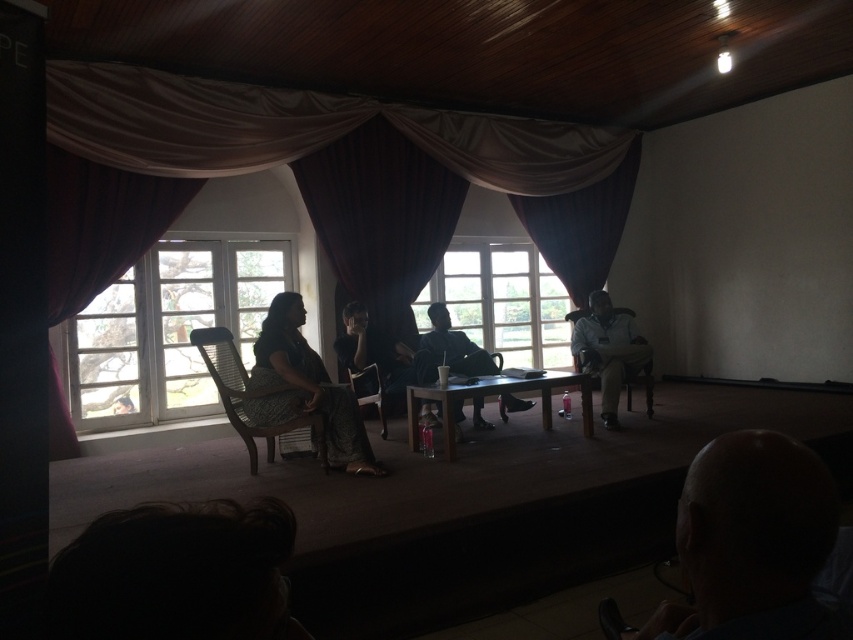
You are a stagehand who needs to place a 28 inch wide decorative panel between the wooden table at center and the matte black shirt at center. Can the panel fit in the space between them?

The distance between the wooden table at center and the matte black shirt at center is 30.65 inches. Since the panel is 28 inches wide, it can fit within the available space as 28 is less than 30.65.

You are an event organizer arranging a small gathering in the conference room. You need to place a 1.2 meter wide decorative panel between the white wooden window at left and the woven wood chair at center. Can the space between them accommodate the panel?

The white wooden window at left is wider than the woven wood chair at center. However, the exact distance between them isn not specified in the provided information. Without knowing the actual spacing, it is impossible to determine if the 1.2 meter panel will fit.

You are an event planner setting up a conference room. You need to ensure that the white wooden window at left and the woven wood chair at center are visible to all attendees. Since the chair is shorter, where should you place the chair relative to the window to ensure visibility?

The white wooden window at left is taller than the woven wood chair at center. To ensure visibility, the woven wood chair at center should be placed in front of the white wooden window at left so that it doesn